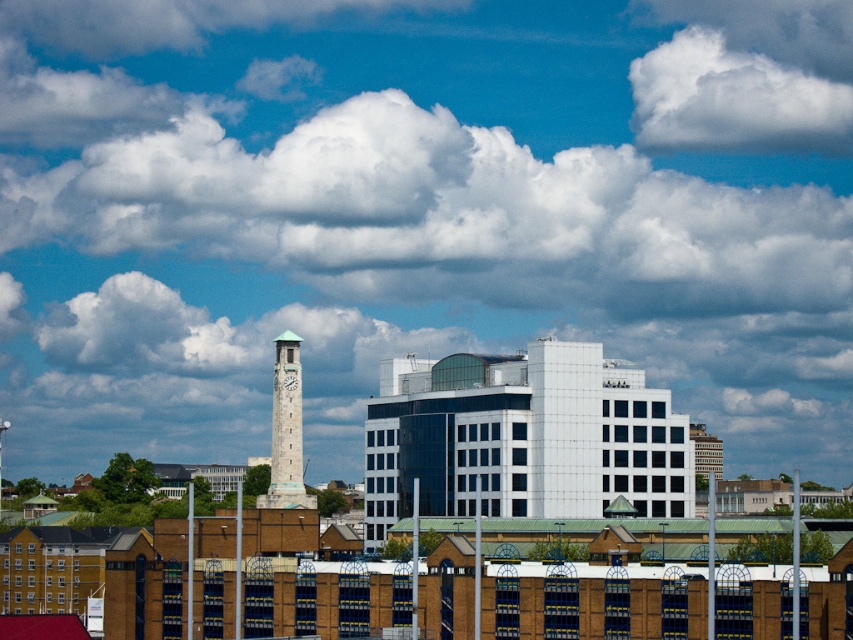
Question: Estimate the real-world distances between objects in this image. Which object is closer to the green stone clock tower at left?

Choices:
 (A) white fluffy cloud at upper center
 (B) white stone clock tower at center-left

Answer: (B)

Question: Based on their relative distances, which object is nearer to the white fluffy cloud at upper center?

Choices:
 (A) white stone clock tower at center-left
 (B) green stone clock tower at left

Answer: (B)

Question: Is green stone clock tower at left to the left of white stone clock tower at center-left from the viewer's perspective?

Choices:
 (A) no
 (B) yes

Answer: (B)

Question: Is the position of green stone clock tower at left less distant than that of white stone clock tower at center-left?

Choices:
 (A) yes
 (B) no

Answer: (A)

Question: Which object is the closest to the green stone clock tower at left?

Choices:
 (A) white fluffy cloud at upper center
 (B) white stone clock tower at center-left

Answer: (B)

Question: From the image, what is the correct spatial relationship of white fluffy cloud at upper center in relation to green stone clock tower at left?

Choices:
 (A) above
 (B) below

Answer: (A)